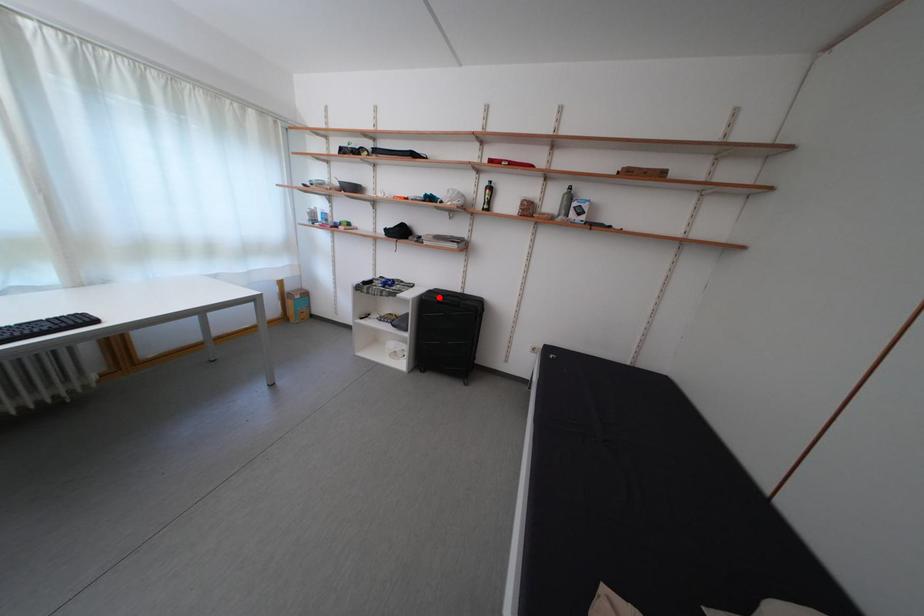
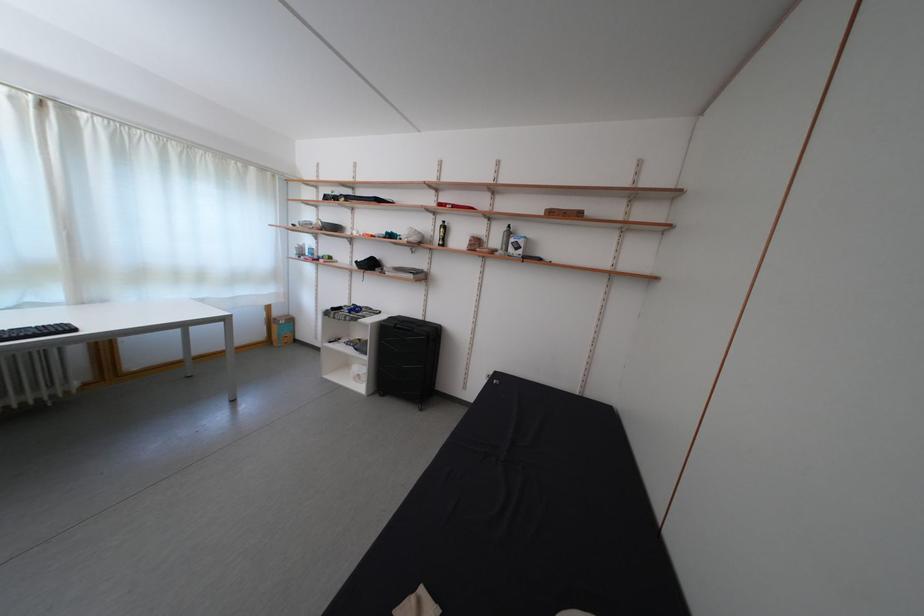
Where in the second image is the point corresponding to the highlighted location from the first image?

(399, 323)